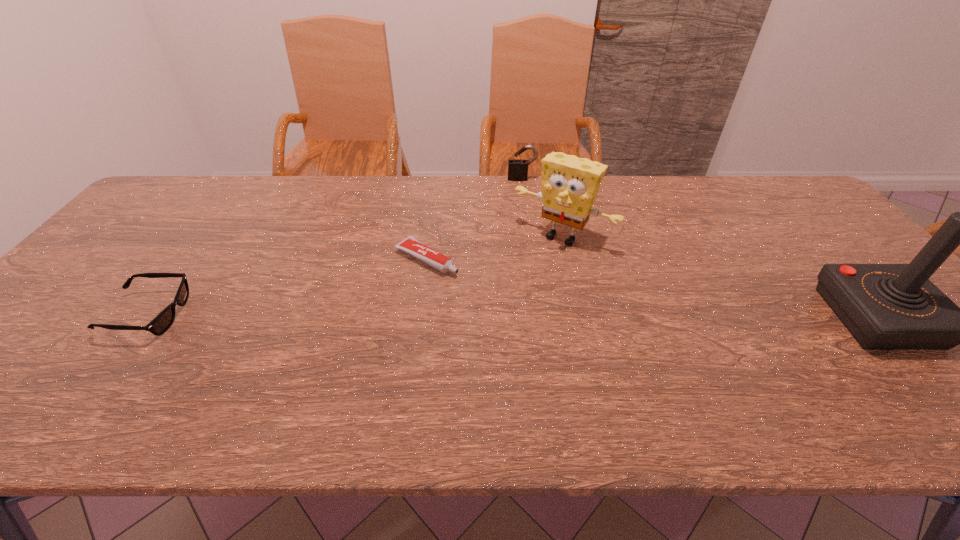
Where is `free space that satisfies the following two spatial constraints: 1. on the back side of the shortest object; 2. on the left side of the sponge`? Image resolution: width=960 pixels, height=540 pixels. free space that satisfies the following two spatial constraints: 1. on the back side of the shortest object; 2. on the left side of the sponge is located at coordinates tap(430, 237).

Identify the location of vacant area in the image that satisfies the following two spatial constraints: 1. on the front side of the second tallest object; 2. on the right side of the third tallest object. (530, 237).